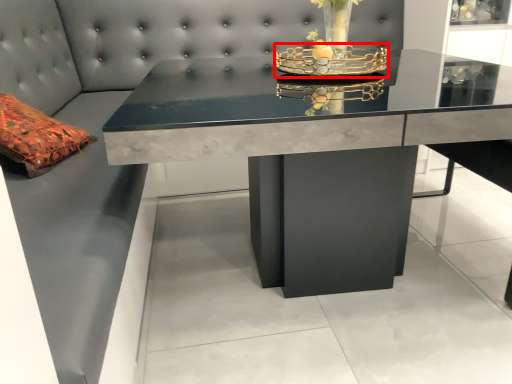
Question: Considering the relative positions of candle holder (annotated by the red box) and table in the image provided, where is candle holder (annotated by the red box) located with respect to the staircase?

Choices:
 (A) left
 (B) right

Answer: (B)